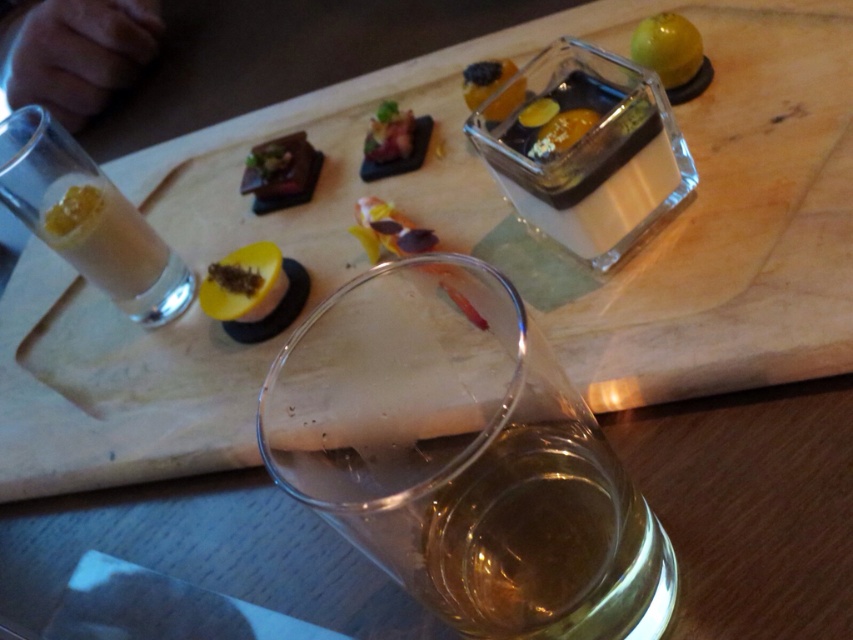
Which is in front, point (212, 264) or point (306, 161)?

Positioned in front is point (212, 264).

Which is below, yellow matte passion fruit at center or matte brown tart at upper left?

yellow matte passion fruit at center is below.

Where is `yellow matte passion fruit at center`? Image resolution: width=853 pixels, height=640 pixels. yellow matte passion fruit at center is located at coordinates (244, 284).

Which is more to the right, translucent glass at center or shiny red meat at center?

translucent glass at center

Can you confirm if translucent glass at center is positioned to the left of shiny red meat at center?

In fact, translucent glass at center is to the right of shiny red meat at center.

Does point (418, 492) come in front of point (380, 109)?

Yes, point (418, 492) is closer to viewer.

The height and width of the screenshot is (640, 853). In order to click on translucent glass at center in this screenshot , I will do `click(463, 458)`.

Does point (503, 74) lie in front of point (387, 141)?

That is True.

Based on the photo, does translucent glass cube at upper center have a smaller size compared to shiny red meat at center?

Actually, translucent glass cube at upper center might be larger than shiny red meat at center.

You are a GUI agent. You are given a task and a screenshot of the screen. Output one action in this format:
    pyautogui.click(x=<x>, y=<y>)
    Task: Click on the translucent glass cube at upper center
    The image size is (853, 640).
    Given the screenshot: What is the action you would take?
    pyautogui.click(x=485, y=80)

I want to click on translucent glass cube at upper center, so click(485, 80).